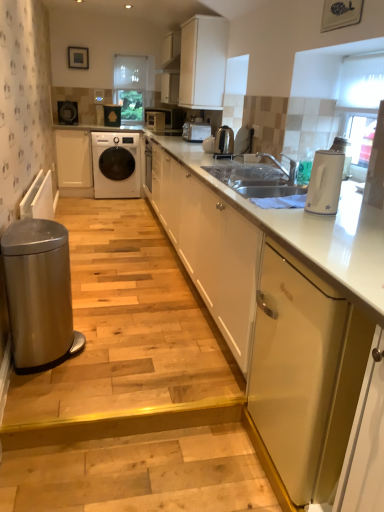
Question: Does metallic gold dishwasher at right come behind metallic silver toaster at upper center, placed as the 1th appliance when sorted from front to back?

Choices:
 (A) no
 (B) yes

Answer: (A)

Question: Is metallic gold dishwasher at right turned away from metallic silver toaster at upper center, which appears as the fifth appliance when viewed from the left?

Choices:
 (A) yes
 (B) no

Answer: (B)

Question: From the image's perspective, is metallic gold dishwasher at right located above metallic silver toaster at upper center, which appears as the fifth appliance when viewed from the left?

Choices:
 (A) no
 (B) yes

Answer: (A)

Question: Is metallic gold dishwasher at right next to metallic silver toaster at upper center, placed as the 1th appliance when sorted from front to back?

Choices:
 (A) yes
 (B) no

Answer: (B)

Question: Does metallic gold dishwasher at right have a smaller size compared to metallic silver toaster at upper center, which ranks as the first appliance in right-to-left order?

Choices:
 (A) no
 (B) yes

Answer: (A)

Question: Would you say natural wood stairs at lower left, arranged as the first stair when ordered from the bottom, is to the left or to the right of metallic gold dishwasher at right in the picture?

Choices:
 (A) right
 (B) left

Answer: (B)

Question: Does point (114, 463) appear closer or farther from the camera than point (256, 292)?

Choices:
 (A) closer
 (B) farther

Answer: (A)

Question: From the image's perspective, is natural wood stairs at lower left, arranged as the first stair when ordered from the bottom, located above or below metallic gold dishwasher at right?

Choices:
 (A) below
 (B) above

Answer: (A)

Question: Relative to metallic gold dishwasher at right, is natural wood stairs at lower left, positioned as the second stair in top-to-bottom order, in front or behind?

Choices:
 (A) front
 (B) behind

Answer: (B)

Question: From their relative heights in the image, would you say white glossy toaster at upper center, the fourth appliance from the top, is taller or shorter than matte black microwave at upper center, positioned as the 3th appliance in top-to-bottom order?

Choices:
 (A) tall
 (B) short

Answer: (B)

Question: Relative to matte black microwave at upper center, arranged as the 2th appliance when viewed from the back, is white glossy toaster at upper center, the 4th appliance viewed from the left, in front or behind?

Choices:
 (A) behind
 (B) front

Answer: (B)

Question: Is white glossy toaster at upper center, which appears as the fourth appliance when viewed from the back, wider or thinner than matte black microwave at upper center, which is the third appliance from bottom to top?

Choices:
 (A) thin
 (B) wide

Answer: (B)

Question: From the image's perspective, is white glossy toaster at upper center, which is the 2th appliance in right-to-left order, above or below matte black microwave at upper center, arranged as the 2th appliance when viewed from the back?

Choices:
 (A) above
 (B) below

Answer: (B)

Question: Based on their positions, is white glossy electric kettle at right located to the left or right of white matte cabinet at upper center, which is the 2th cabinetry from right to left?

Choices:
 (A) right
 (B) left

Answer: (A)

Question: From a real-world perspective, is white glossy electric kettle at right physically located above or below white matte cabinet at upper center, positioned as the second cabinetry in left-to-right order?

Choices:
 (A) below
 (B) above

Answer: (A)